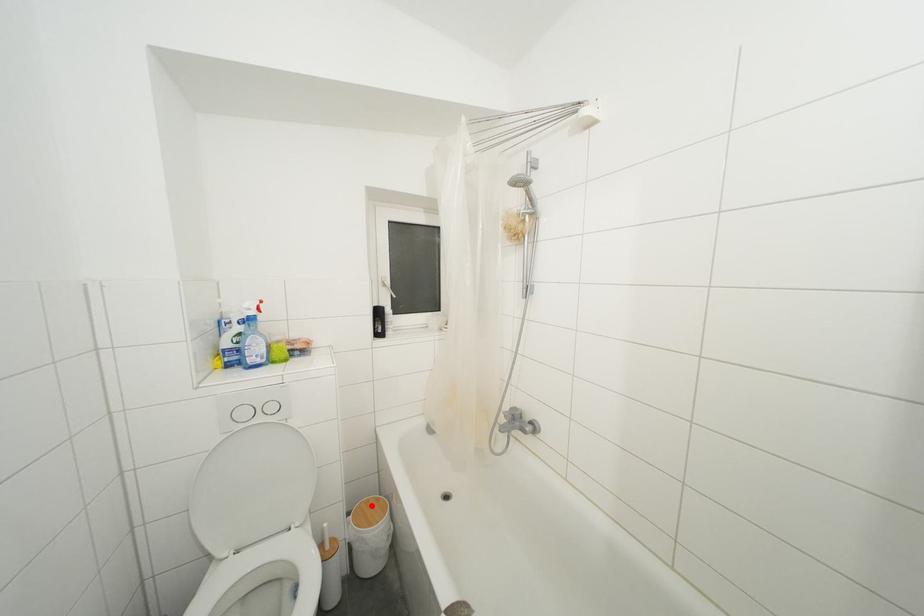
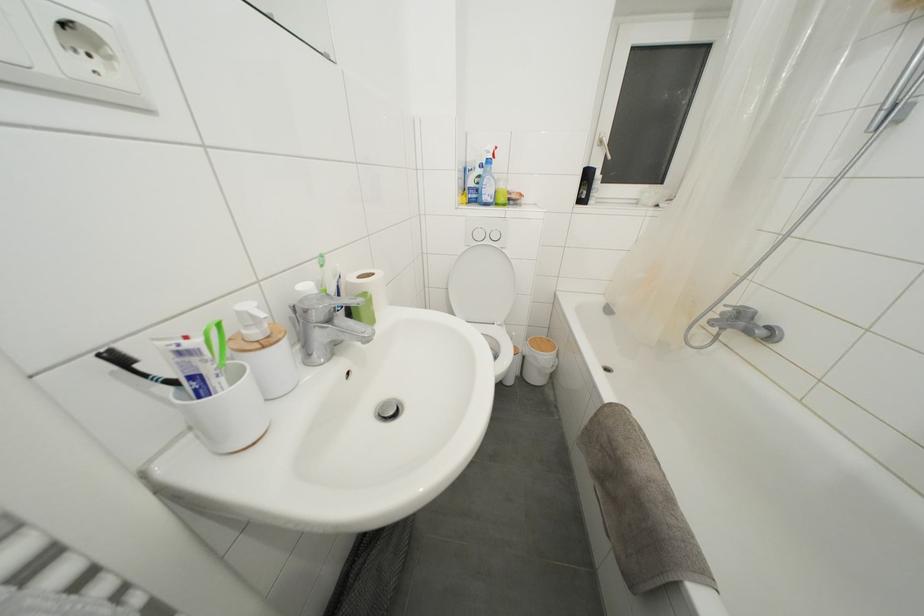
Find the pixel in the second image that matches the highlighted location in the first image.

(544, 342)